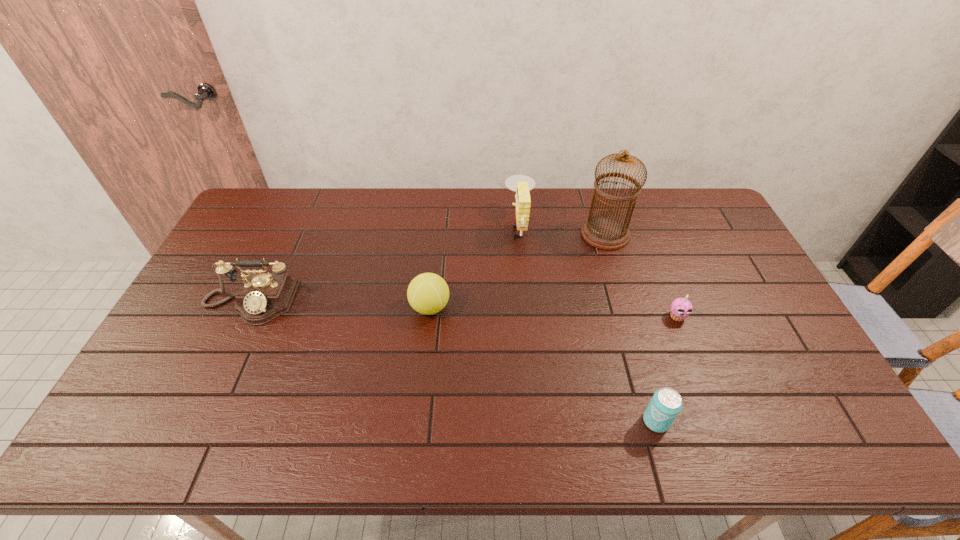
Locate an element on the screen. This screenshot has width=960, height=540. unoccupied area between the shortest object and the second object from left to right is located at coordinates (554, 312).

You are a GUI agent. You are given a task and a screenshot of the screen. Output one action in this format:
    pyautogui.click(x=<x>, y=<y>)
    Task: Click on the free space that is in between the shortest object and the beer can
    Image resolution: width=960 pixels, height=540 pixels.
    Given the screenshot: What is the action you would take?
    pyautogui.click(x=667, y=369)

Locate an element on the screen. The image size is (960, 540). free space that is in between the rightmost object and the nearest object is located at coordinates tap(667, 369).

Where is `object that is the fifth closest one to the shortest object`? object that is the fifth closest one to the shortest object is located at coordinates (262, 297).

Identify which object is located as the fifth nearest to the nearest object. Please provide its 2D coordinates. Your answer should be formatted as a tuple, i.e. [(x, y)], where the tuple contains the x and y coordinates of a point satisfying the conditions above.

[(262, 297)]

The image size is (960, 540). In order to click on vacant space that satisfies the following two spatial constraints: 1. on the front-facing side of the third object from left to right; 2. on the left side of the nearest object in this screenshot , I will do pyautogui.click(x=539, y=421).

Locate an element on the screen. Image resolution: width=960 pixels, height=540 pixels. free space that satisfies the following two spatial constraints: 1. on the dial of the nearest object; 2. on the right side of the telephone is located at coordinates (194, 421).

Locate an element on the screen. blank area in the image that satisfies the following two spatial constraints: 1. on the dial of the nearest object; 2. on the right side of the telephone is located at coordinates (194, 421).

Where is `free spot that satisfies the following two spatial constraints: 1. on the front-facing side of the tallest object; 2. on the dial of the telephone`? This screenshot has height=540, width=960. free spot that satisfies the following two spatial constraints: 1. on the front-facing side of the tallest object; 2. on the dial of the telephone is located at coordinates (626, 302).